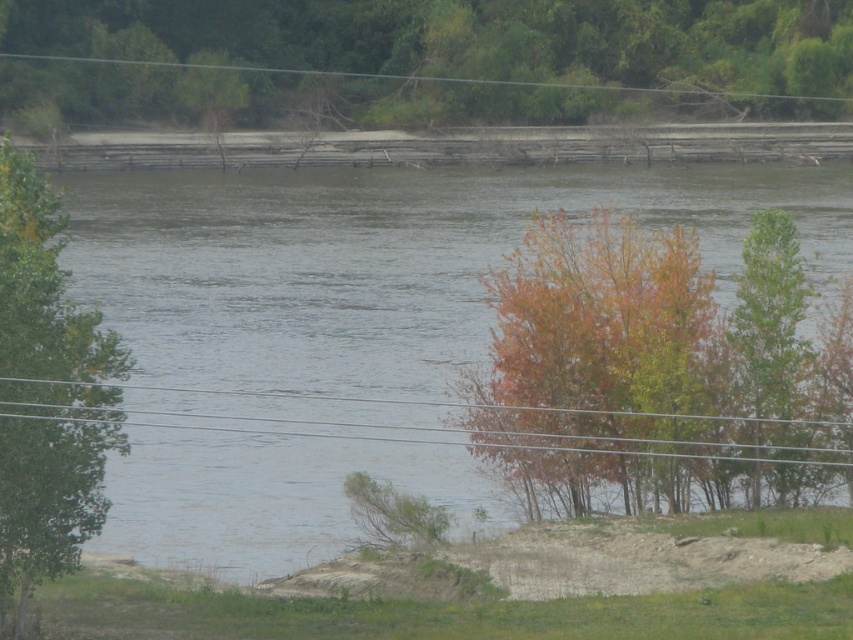
You are planning to take a photo of the riverside scene. You want to include both the multicolored foliage at center and the green leafy tree at left in your shot. Which object should you focus on first if you want to ensure both are in frame without moving the camera?

You should focus on the green leafy tree at left first because it is larger than the multicolored foliage at center, so it will be easier to frame both by centering the larger object first.

You are standing at the point marked by coordinates point (419, 61) in the riverside scene. Looking around, you notice a green leafy tree at upper center. Which direction should you face to see the green leafy tree at upper center?

Since point (419, 61) marks the green leafy tree at upper center, you are already facing the tree. Therefore, you should face forward to see the green leafy tree at upper center.

You are a bird looking for a place to perch. You see the green leafy tree at upper center and the metallic wires at center. Which option provides a larger surface area for you to land on?

The green leafy tree at upper center has a larger size compared to metallic wires at center, so it provides a larger surface area for you to land on.